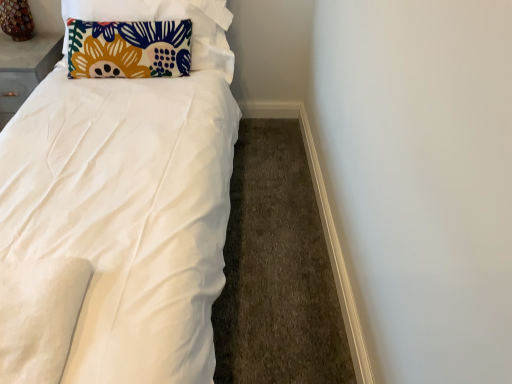
Question: From a real-world perspective, is matte gray table at upper left physically above wooden table lamp at upper left?

Choices:
 (A) no
 (B) yes

Answer: (A)

Question: Is matte gray table at upper left not near wooden table lamp at upper left?

Choices:
 (A) yes
 (B) no

Answer: (B)

Question: Is matte gray table at upper left completely or partially outside of wooden table lamp at upper left?

Choices:
 (A) yes
 (B) no

Answer: (A)

Question: From the image's perspective, does matte gray table at upper left appear lower than wooden table lamp at upper left?

Choices:
 (A) no
 (B) yes

Answer: (B)

Question: Is matte gray table at upper left bigger than wooden table lamp at upper left?

Choices:
 (A) no
 (B) yes

Answer: (B)

Question: Is floral fabric pillow at upper left taller or shorter than white smooth baseboard at lower right?

Choices:
 (A) tall
 (B) short

Answer: (A)

Question: Is floral fabric pillow at upper left situated inside white smooth baseboard at lower right or outside?

Choices:
 (A) outside
 (B) inside

Answer: (A)

Question: Is floral fabric pillow at upper left in front of or behind white smooth baseboard at lower right in the image?

Choices:
 (A) front
 (B) behind

Answer: (B)

Question: Looking at their shapes, would you say floral fabric pillow at upper left is wider or thinner than white smooth baseboard at lower right?

Choices:
 (A) wide
 (B) thin

Answer: (A)

Question: In the image, is floral fabric pillow at upper left on the left side or the right side of matte gray table at upper left?

Choices:
 (A) right
 (B) left

Answer: (A)

Question: Is floral fabric pillow at upper left inside the boundaries of matte gray table at upper left, or outside?

Choices:
 (A) outside
 (B) inside

Answer: (A)

Question: From the image's perspective, is floral fabric pillow at upper left above or below matte gray table at upper left?

Choices:
 (A) above
 (B) below

Answer: (A)

Question: From a real-world perspective, is floral fabric pillow at upper left above or below matte gray table at upper left?

Choices:
 (A) above
 (B) below

Answer: (A)

Question: From their relative heights in the image, would you say matte gray table at upper left is taller or shorter than white smooth baseboard at lower right?

Choices:
 (A) short
 (B) tall

Answer: (B)

Question: In the image, is matte gray table at upper left positioned in front of or behind white smooth baseboard at lower right?

Choices:
 (A) front
 (B) behind

Answer: (B)